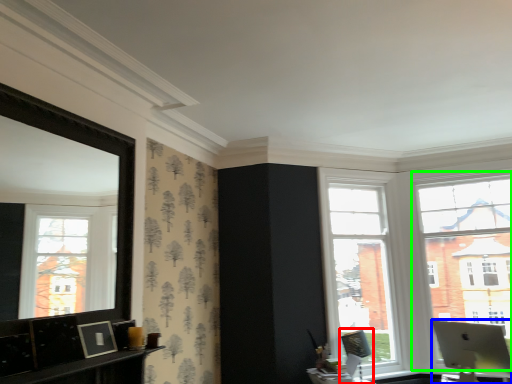
Question: Estimate the real-world distances between objects in this image. Which object is closer to swivel chair (highlighted by a red box), laptop (highlighted by a blue box) or window (highlighted by a green box)?

Choices:
 (A) laptop
 (B) window

Answer: (A)